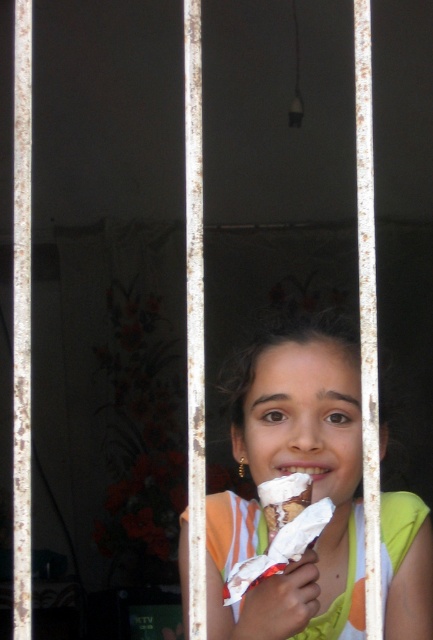
You are a safety inspector in a construction zone. You notice two items at the center of your view. The yellow fabric safety vest at center and the white creamy ice cream cone at center. According to safety protocols, which item should be placed to the right to avoid blocking the emergency exit sign located to the left?

The yellow fabric safety vest at center should be moved to the right because it is currently to the left of the white creamy ice cream cone at center, and moving it would clear the area near the emergency exit sign on the left.

You are a safety inspector evaluating the visibility of the yellow fabric safety vest at center and the white creamy ice cream cone at center in the image. Considering their sizes, which object would be more noticeable to someone passing by?

The yellow fabric safety vest at center is bigger than the white creamy ice cream cone at center, so it would be more noticeable due to its larger size.